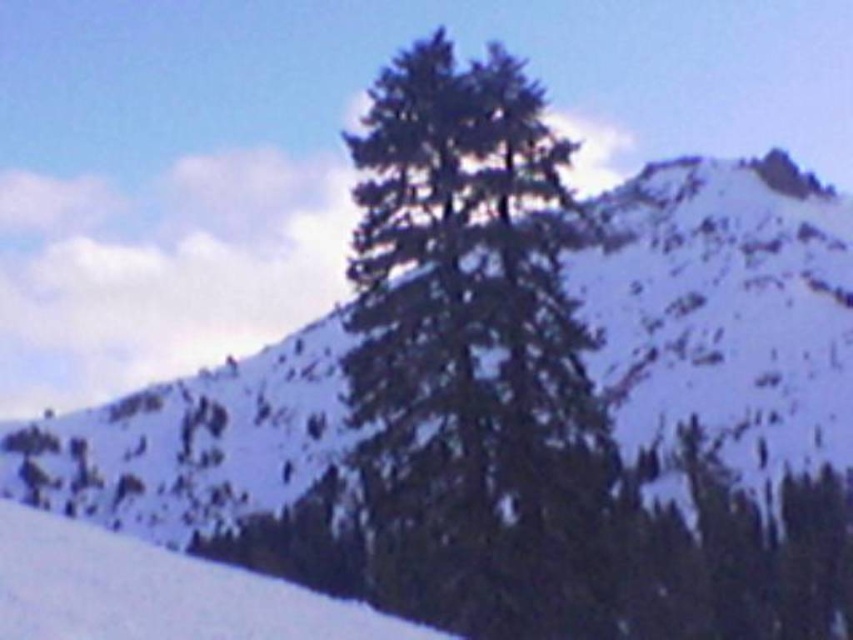
At what (x,y) coordinates should I click in order to perform the action: click on green textured tree at center. Please return your answer as a coordinate pair (x, y). This screenshot has width=853, height=640. Looking at the image, I should click on (474, 358).

Between green textured tree at center and white snow at lower left, which one is positioned higher?

white snow at lower left

Describe the element at coordinates (474, 358) in the screenshot. I see `green textured tree at center` at that location.

Find the location of a particular element. The image size is (853, 640). green textured tree at center is located at coordinates (474, 358).